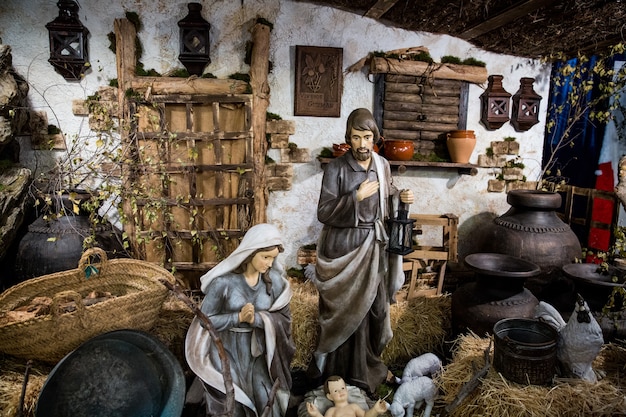
This screenshot has width=626, height=417. I want to click on lanters on wall, so click(x=531, y=110), click(x=494, y=111), click(x=192, y=37), click(x=67, y=52).